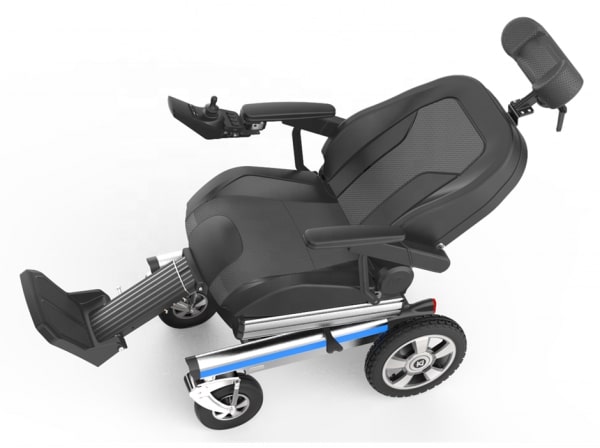
In order to click on footrest extender in this screenshot , I will do `click(142, 300)`.